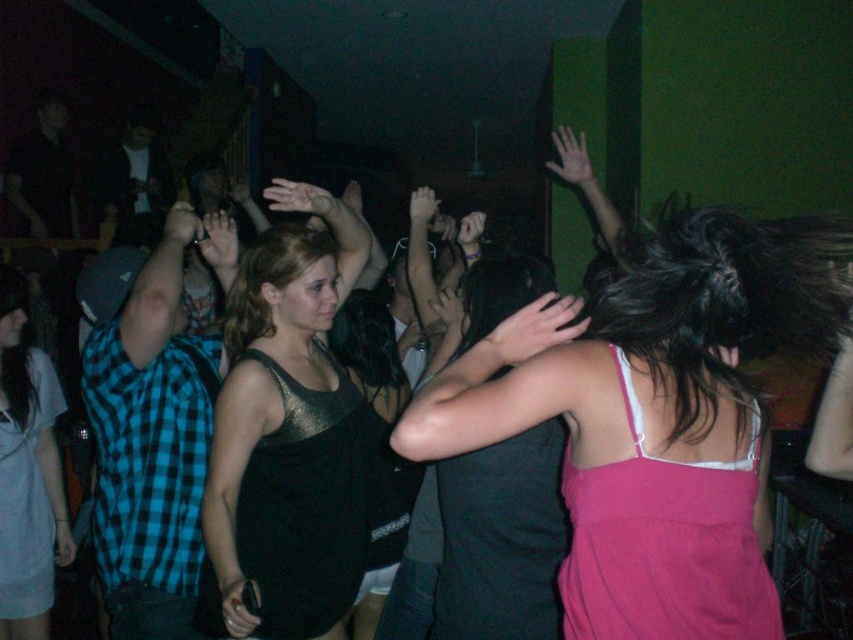
Which of these two, shiny black dress at center or pink satin dress at upper right, stands taller?

shiny black dress at center is taller.

Is point (351, 225) closer to viewer compared to point (654, 488)?

No.

This screenshot has height=640, width=853. I want to click on shiny black dress at center, so click(x=287, y=433).

Does pink fabric dress at center have a lesser width compared to metallic tank top at center?

In fact, pink fabric dress at center might be wider than metallic tank top at center.

Can you confirm if pink fabric dress at center is positioned to the left of metallic tank top at center?

Incorrect, pink fabric dress at center is not on the left side of metallic tank top at center.

Is point (552, 404) positioned in front of point (7, 378)?

Yes, point (552, 404) is in front of point (7, 378).

Find the location of a particular element. The height and width of the screenshot is (640, 853). pink fabric dress at center is located at coordinates (654, 417).

Can you confirm if shiny black dress at center is shorter than metallic tank top at center?

Incorrect, shiny black dress at center's height does not fall short of metallic tank top at center's.

Is shiny black dress at center wider than metallic tank top at center?

Correct, the width of shiny black dress at center exceeds that of metallic tank top at center.

Is point (274, 426) positioned in front of point (4, 326)?

Yes, point (274, 426) is in front of point (4, 326).

This screenshot has height=640, width=853. In order to click on shiny black dress at center in this screenshot , I will do `click(287, 433)`.